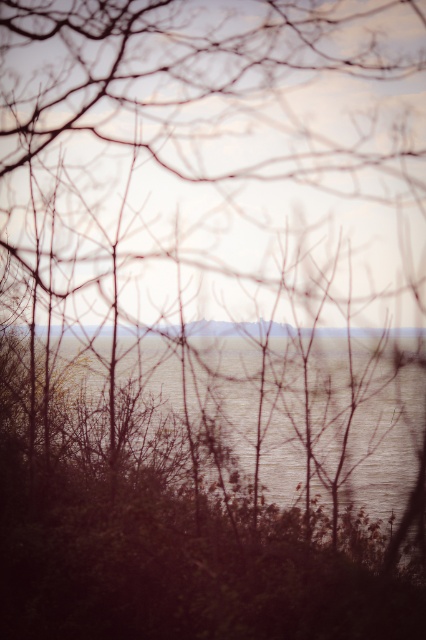
Question: Is silvery reflective water at center to the left of smooth water at center from the viewer's perspective?

Choices:
 (A) no
 (B) yes

Answer: (B)

Question: Is silvery reflective water at center closer to the viewer compared to smooth water at center?

Choices:
 (A) yes
 (B) no

Answer: (A)

Question: Can you confirm if silvery reflective water at center is thinner than smooth water at center?

Choices:
 (A) no
 (B) yes

Answer: (A)

Question: Which of the following is the farthest from the observer?

Choices:
 (A) (134, 333)
 (B) (92, 452)

Answer: (B)

Question: Which object appears closest to the camera in this image?

Choices:
 (A) smooth water at center
 (B) silvery reflective water at center

Answer: (B)